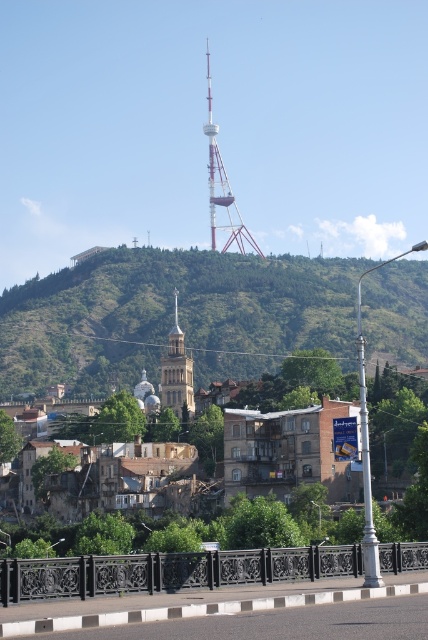
Question: Does metallic lattice tower at center appear over golden stone church at center?

Choices:
 (A) no
 (B) yes

Answer: (B)

Question: Among these points, which one is nearest to the camera?

Choices:
 (A) tap(175, 396)
 (B) tap(247, 243)
 (C) tap(395, 296)

Answer: (A)

Question: From the image, what is the correct spatial relationship of green leafy hillside at upper center in relation to metallic lattice tower at center?

Choices:
 (A) above
 (B) below

Answer: (B)

Question: Estimate the real-world distances between objects in this image. Which object is closer to the green leafy hillside at upper center?

Choices:
 (A) golden stone church at center
 (B) metallic lattice tower at center

Answer: (A)

Question: Which object appears farthest from the camera in this image?

Choices:
 (A) golden stone church at center
 (B) metallic lattice tower at center
 (C) green leafy hillside at upper center

Answer: (B)

Question: Does green leafy hillside at upper center come behind golden stone church at center?

Choices:
 (A) no
 (B) yes

Answer: (B)